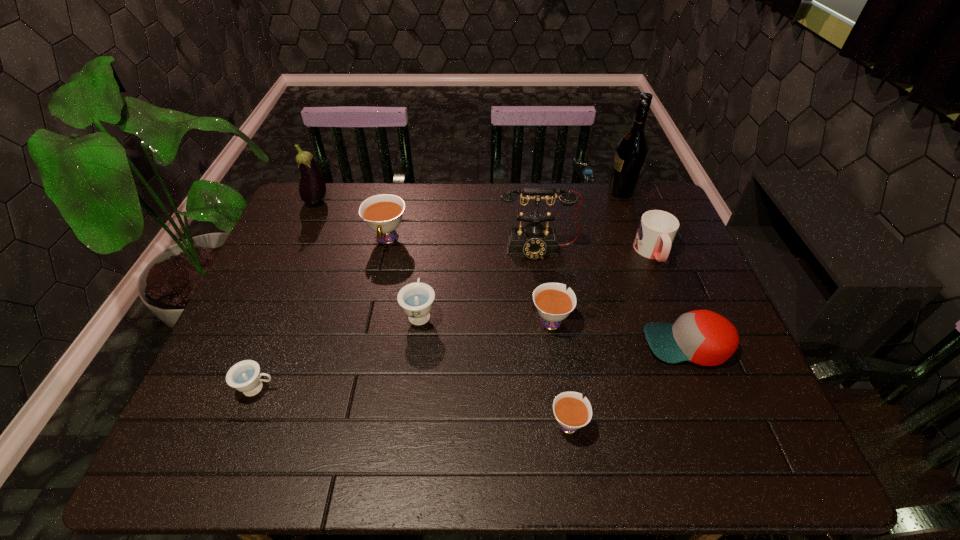
Image resolution: width=960 pixels, height=540 pixels. Identify the location of the tallest object. (631, 152).

In order to click on wine bottle in this screenshot , I will do `click(631, 152)`.

In order to click on eggplant in this screenshot , I will do `click(312, 187)`.

Image resolution: width=960 pixels, height=540 pixels. I want to click on black telephone, so click(x=534, y=240).

You are a GUI agent. You are given a task and a screenshot of the screen. Output one action in this format:
    pyautogui.click(x=<x>, y=<y>)
    Task: Click on the tallest teacup
    This screenshot has width=960, height=540.
    Given the screenshot: What is the action you would take?
    pyautogui.click(x=382, y=213)

At what (x,y) coordinates should I click in order to perform the action: click on the farthest teacup. Please return your answer as a coordinate pair (x, y). This screenshot has height=540, width=960. Looking at the image, I should click on (382, 213).

Locate an element on the screen. Image resolution: width=960 pixels, height=540 pixels. mug is located at coordinates (657, 229).

In order to click on the second farthest white teacup in this screenshot , I will do `click(553, 303)`.

At what (x,y) coordinates should I click in order to perform the action: click on red baseball cap. Please return your answer as a coordinate pair (x, y). The height and width of the screenshot is (540, 960). Looking at the image, I should click on (703, 337).

Locate an element on the screen. The height and width of the screenshot is (540, 960). the third teacup from right to left is located at coordinates (416, 299).